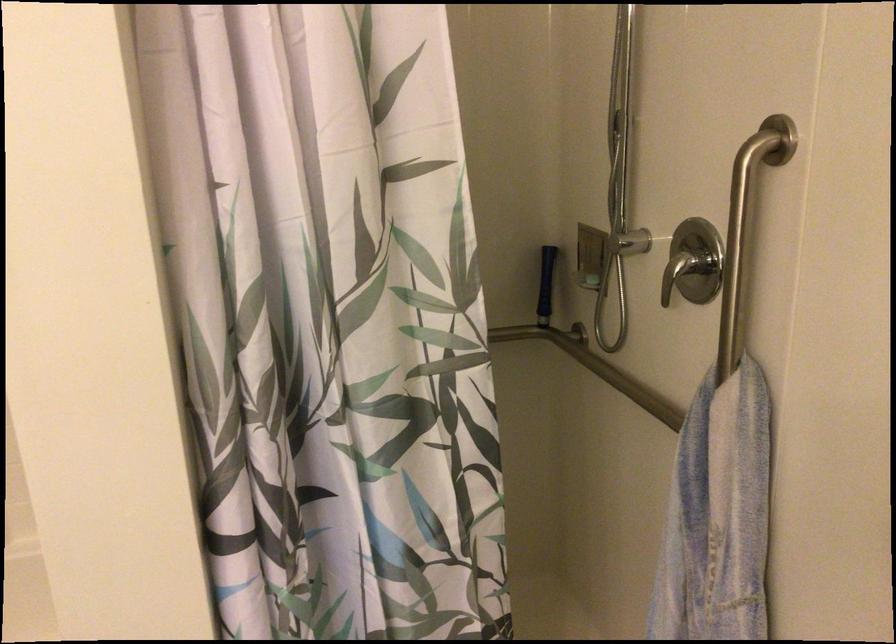
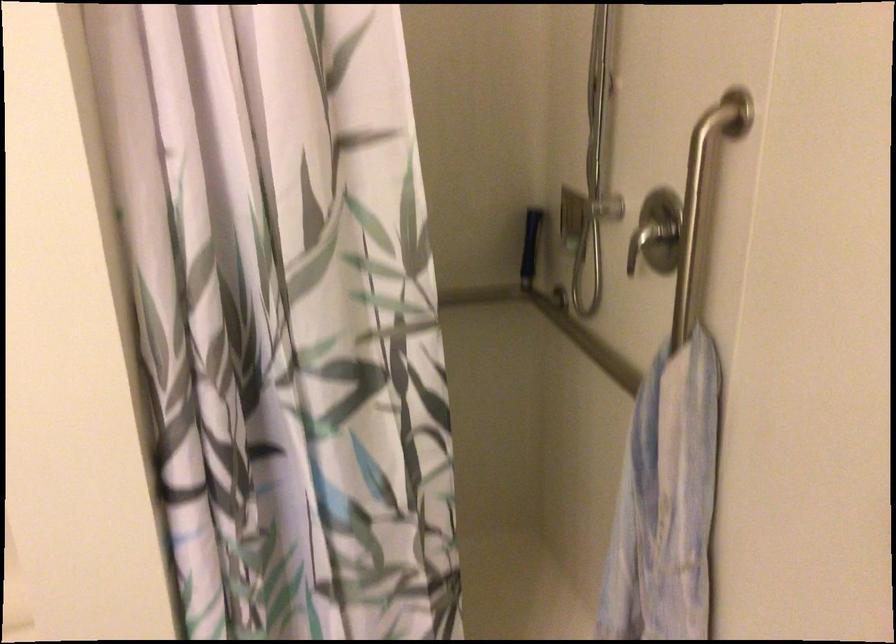
What movement of the cameraman would produce the second image?

The cameraman walked toward right, backward.